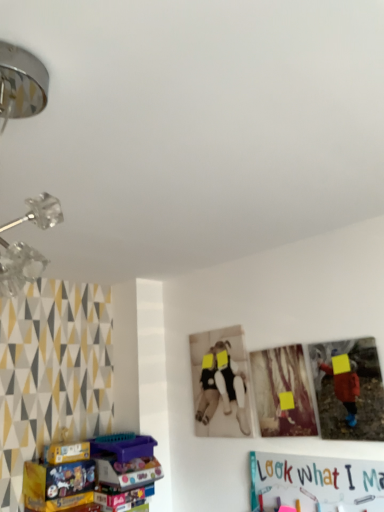
Question: Is metallic chrome lamp at upper left facing towards matte cardboard box at lower left?

Choices:
 (A) yes
 (B) no

Answer: (B)

Question: Is metallic chrome lamp at upper left oriented away from matte cardboard box at lower left?

Choices:
 (A) yes
 (B) no

Answer: (B)

Question: Is metallic chrome lamp at upper left placed right next to matte cardboard box at lower left?

Choices:
 (A) yes
 (B) no

Answer: (B)

Question: From the image's perspective, does metallic chrome lamp at upper left appear higher than matte cardboard box at lower left?

Choices:
 (A) no
 (B) yes

Answer: (B)

Question: Is metallic chrome lamp at upper left positioned before matte cardboard box at lower left?

Choices:
 (A) no
 (B) yes

Answer: (B)

Question: Is metallic chrome lamp at upper left taller or shorter than matte cardboard box at lower left?

Choices:
 (A) tall
 (B) short

Answer: (A)

Question: Is point (36, 262) closer or farther from the camera than point (89, 448)?

Choices:
 (A) closer
 (B) farther

Answer: (A)

Question: From the image's perspective, is metallic chrome lamp at upper left above or below matte cardboard box at lower left?

Choices:
 (A) below
 (B) above

Answer: (B)

Question: From a real-world perspective, is metallic chrome lamp at upper left physically located above or below matte cardboard box at lower left?

Choices:
 (A) above
 (B) below

Answer: (A)

Question: In terms of width, does wooden photo frame at center, the 1th picture frame in the left-to-right sequence, look wider or thinner when compared to metallic chrome lamp at upper left?

Choices:
 (A) wide
 (B) thin

Answer: (B)

Question: Looking at the image, does wooden photo frame at center, which is counted as the second picture frame, starting from the right, seem bigger or smaller compared to metallic chrome lamp at upper left?

Choices:
 (A) small
 (B) big

Answer: (A)

Question: Is wooden photo frame at center, the 1th picture frame in the left-to-right sequence, situated inside metallic chrome lamp at upper left or outside?

Choices:
 (A) outside
 (B) inside

Answer: (A)

Question: From a real-world perspective, is wooden photo frame at center, which is counted as the second picture frame, starting from the right, above or below metallic chrome lamp at upper left?

Choices:
 (A) above
 (B) below

Answer: (B)

Question: From the image's perspective, is matte cardboard box at lower left located above or below metallic chrome lamp at upper left?

Choices:
 (A) above
 (B) below

Answer: (B)

Question: Considering their positions, is matte cardboard box at lower left located in front of or behind metallic chrome lamp at upper left?

Choices:
 (A) behind
 (B) front

Answer: (A)